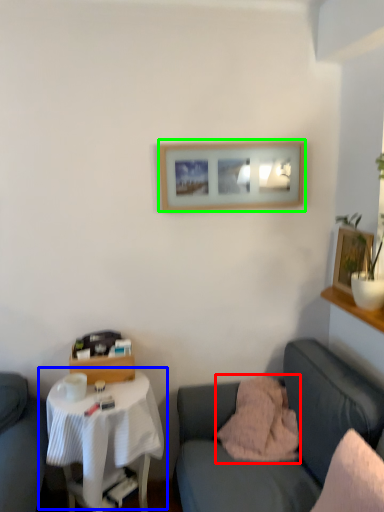
Question: Based on their relative distances, which object is farther from pillow (highlighted by a red box)? Choose from table (highlighted by a blue box) and picture frame (highlighted by a green box).

Choices:
 (A) table
 (B) picture frame

Answer: (B)